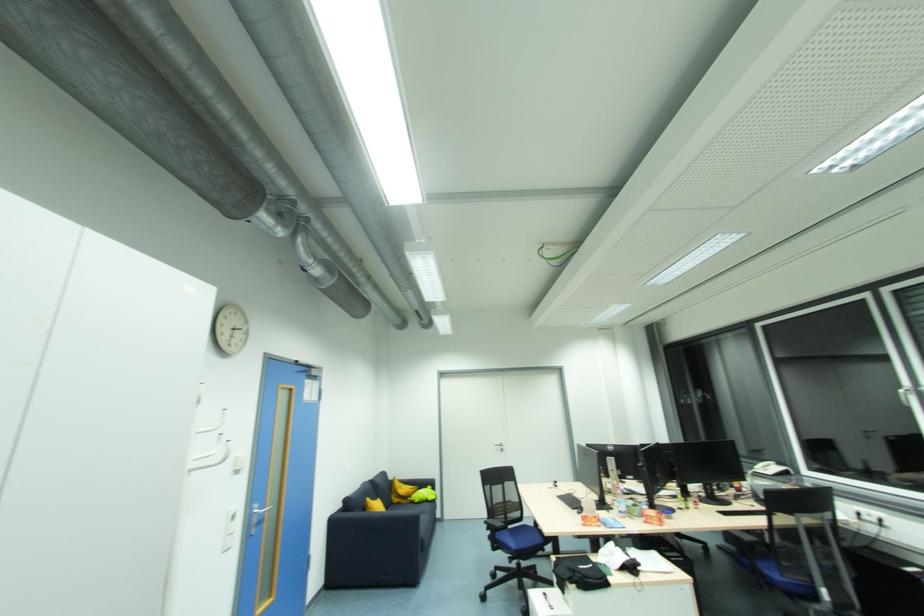
Describe the element at coordinates (797, 500) in the screenshot. I see `the chair back top rail` at that location.